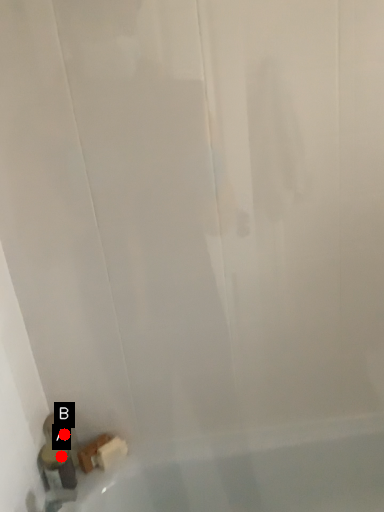
Question: Two points are circled on the image, labeled by A and B beside each circle. Which point is closer to the camera?

Choices:
 (A) A is closer
 (B) B is closer

Answer: (A)